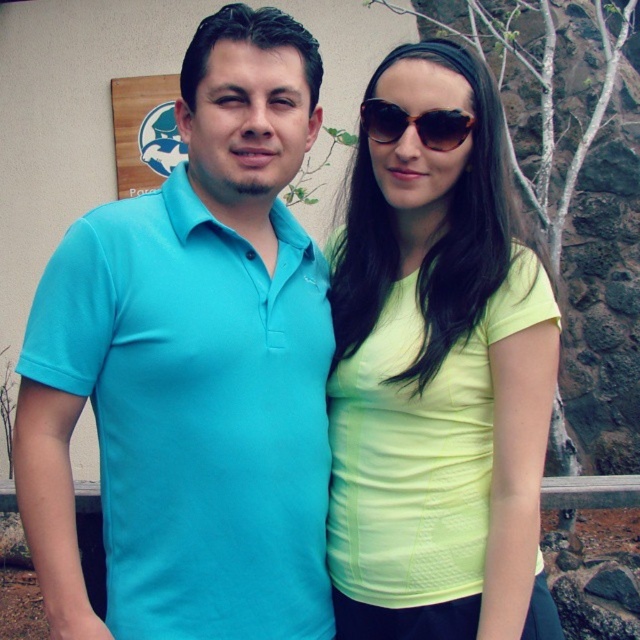
Between point (273, 573) and point (456, 115), which one is positioned behind?

Point (273, 573)

Looking at this image, which is above, matte blue polo shirt at left or brown textured sunglasses at center?

brown textured sunglasses at center is above.

Is point (228, 157) less distant than point (390, 129)?

Yes.

What are the coordinates of `matte blue polo shirt at left` in the screenshot? It's located at (193, 369).

Which is below, matte blue polo shirt at left or neon yellow fabric at center?

neon yellow fabric at center is below.

Is matte blue polo shirt at left closer to the viewer compared to neon yellow fabric at center?

That is False.

This screenshot has width=640, height=640. Identify the location of matte blue polo shirt at left. (193, 369).

Does neon yellow fabric at center have a larger size compared to brown textured sunglasses at center?

Correct, neon yellow fabric at center is larger in size than brown textured sunglasses at center.

Can you confirm if neon yellow fabric at center is taller than brown textured sunglasses at center?

Yes, neon yellow fabric at center is taller than brown textured sunglasses at center.

The image size is (640, 640). I want to click on neon yellow fabric at center, so click(x=438, y=378).